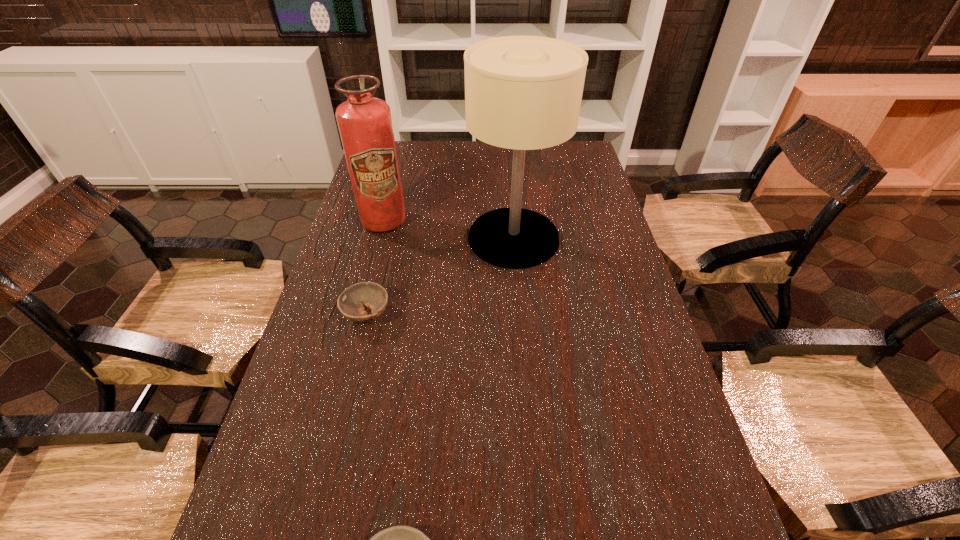
In the image, there is a desktop. Where is `vacant area at the far edge`? This screenshot has width=960, height=540. vacant area at the far edge is located at coordinates (434, 161).

Identify the location of vacant space at the left edge of the desktop. (342, 447).

You are a GUI agent. You are given a task and a screenshot of the screen. Output one action in this format:
    pyautogui.click(x=<x>, y=<y>)
    Task: Click on the vacant space at the right edge
    The height and width of the screenshot is (540, 960).
    Given the screenshot: What is the action you would take?
    pyautogui.click(x=608, y=295)

Identify the location of free space at the far right corner. (560, 168).

At what (x,y) coordinates should I click in order to perform the action: click on free spot between the second shortest object and the tallest object. Please return your answer as a coordinate pair (x, y). This screenshot has height=540, width=960. Looking at the image, I should click on (440, 276).

At what (x,y) coordinates should I click in order to perform the action: click on free space between the farther bowl and the tallest object. Please return your answer as a coordinate pair (x, y). Looking at the image, I should click on (440, 276).

The height and width of the screenshot is (540, 960). I want to click on unoccupied position between the farther bowl and the tallest object, so click(x=440, y=276).

Locate an element on the screen. The height and width of the screenshot is (540, 960). vacant space that's between the table lamp and the second tallest object is located at coordinates (448, 230).

Locate an element on the screen. free space between the second tallest object and the taller bowl is located at coordinates (375, 268).

Image resolution: width=960 pixels, height=540 pixels. What are the coordinates of `the second closest object relative to the taller bowl` in the screenshot? It's located at pyautogui.click(x=364, y=122).